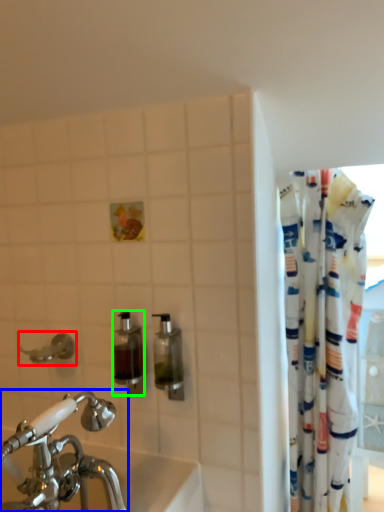
Question: Estimate the real-world distances between objects in this image. Which object is farther from plumbing fixture (highlighted by a red box), tap (highlighted by a blue box) or soap dispenser (highlighted by a green box)?

Choices:
 (A) tap
 (B) soap dispenser

Answer: (A)